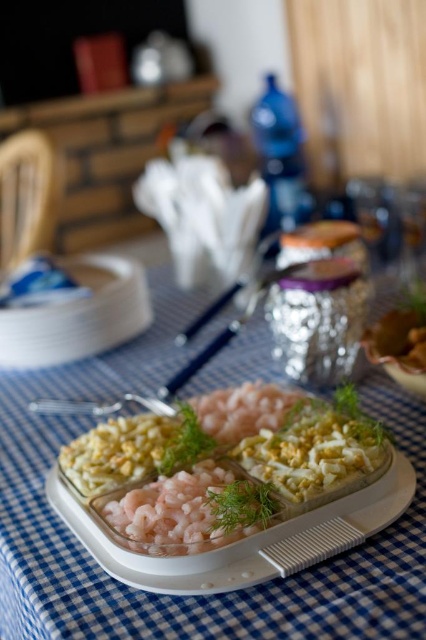
Question: Estimate the real-world distances between objects in this image. Which object is farther from the white creamy pasta at center?

Choices:
 (A) blue checkered tablecloth at center
 (B) pink translucent shrimp at center

Answer: (A)

Question: Does blue checkered tablecloth at center appear over white creamy pasta at center?

Choices:
 (A) no
 (B) yes

Answer: (B)

Question: Considering the real-world distances, which object is closest to the pink translucent shrimp at center?

Choices:
 (A) white creamy pasta at center
 (B) blue checkered tablecloth at center
 (C) white glossy appetizer at center

Answer: (C)

Question: Considering the relative positions of blue checkered tablecloth at center and pink translucent shrimp at center in the image provided, where is blue checkered tablecloth at center located with respect to pink translucent shrimp at center?

Choices:
 (A) above
 (B) below

Answer: (A)

Question: Observing the image, what is the correct spatial positioning of white glossy appetizer at center in reference to pink translucent shrimp at center?

Choices:
 (A) right
 (B) left

Answer: (A)

Question: Which object is positioned closest to the white glossy appetizer at center?

Choices:
 (A) blue checkered tablecloth at center
 (B) white creamy pasta at center
 (C) pink translucent shrimp at center

Answer: (B)